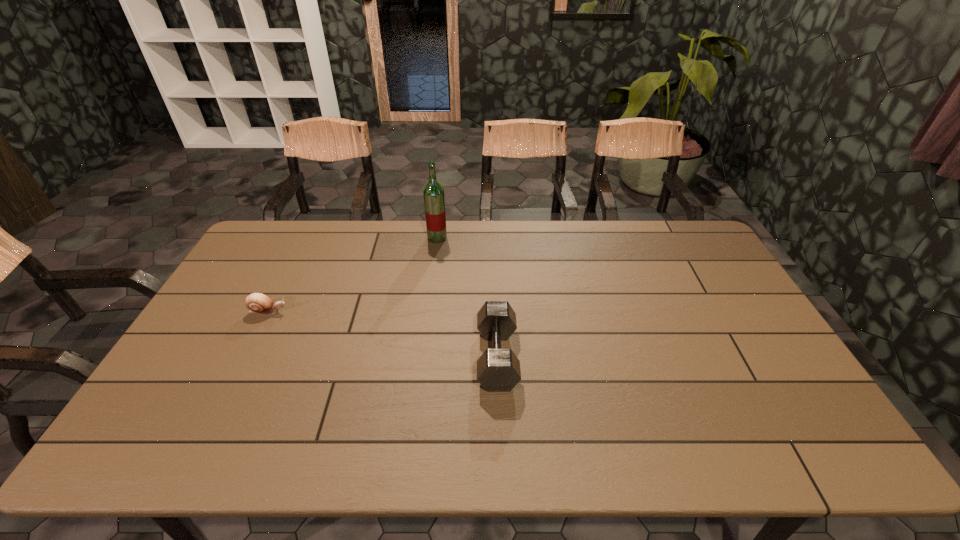
Where is `free spot that satisfies the following two spatial constraints: 1. on the front-facing side of the leftmost object; 2. on the left side of the dumbbell`? Image resolution: width=960 pixels, height=540 pixels. free spot that satisfies the following two spatial constraints: 1. on the front-facing side of the leftmost object; 2. on the left side of the dumbbell is located at coordinates (246, 357).

The width and height of the screenshot is (960, 540). Find the location of `vacant space that satisfies the following two spatial constraints: 1. on the front side of the second object from left to right; 2. on the right side of the second shortest object`. vacant space that satisfies the following two spatial constraints: 1. on the front side of the second object from left to right; 2. on the right side of the second shortest object is located at coordinates tap(422, 357).